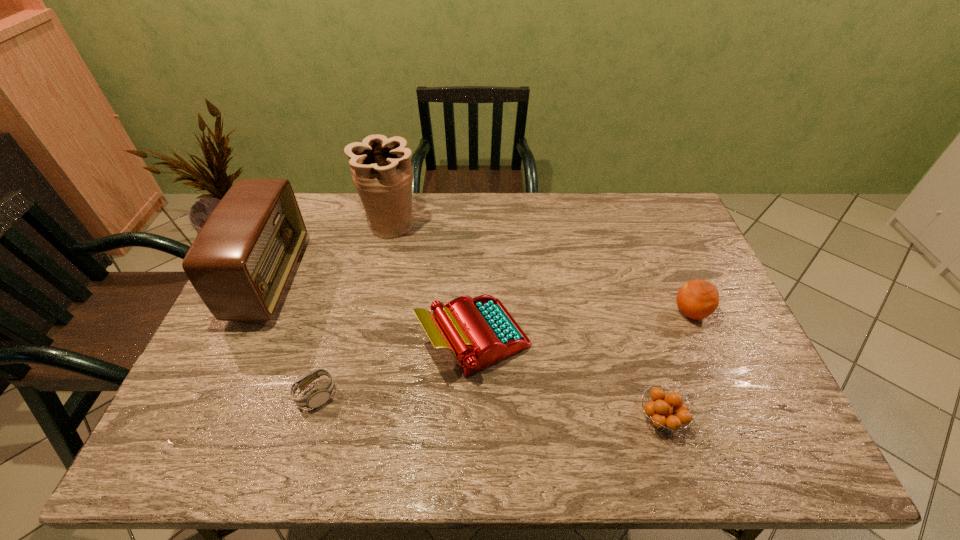
The width and height of the screenshot is (960, 540). Identify the location of vacant area at the near edge. (588, 438).

Locate an element on the screen. Image resolution: width=960 pixels, height=540 pixels. vacant space at the left edge of the desktop is located at coordinates (225, 363).

Find the location of a particular element. free space at the right edge is located at coordinates (721, 395).

This screenshot has width=960, height=540. Find the location of `free space that is in between the urn and the watch`. free space that is in between the urn and the watch is located at coordinates (353, 309).

This screenshot has height=540, width=960. What are the coordinates of `free space between the urn and the fifth tallest object` in the screenshot? It's located at (525, 321).

The width and height of the screenshot is (960, 540). I want to click on vacant region between the urn and the shortest object, so click(353, 309).

Locate an element on the screen. The height and width of the screenshot is (540, 960). free space that is in between the fourth object from left to right and the third shortest object is located at coordinates (583, 326).

Locate an element on the screen. empty space between the farther orange fruit and the fourth shortest object is located at coordinates (583, 326).

Image resolution: width=960 pixels, height=540 pixels. I want to click on free area in between the radio receiver and the fourth shortest object, so click(372, 309).

The width and height of the screenshot is (960, 540). In order to click on object that can be found as the fourth closest to the watch in this screenshot , I will do click(x=662, y=415).